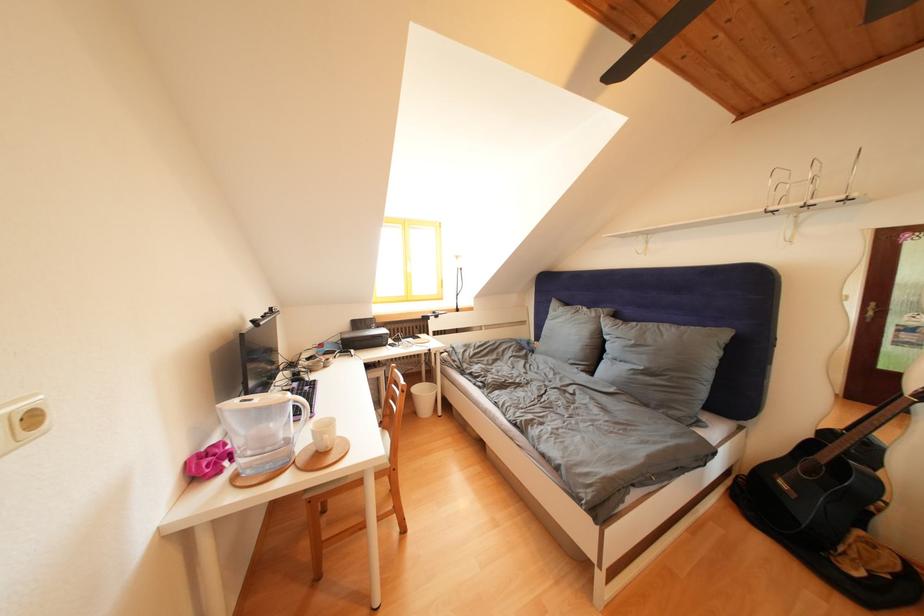
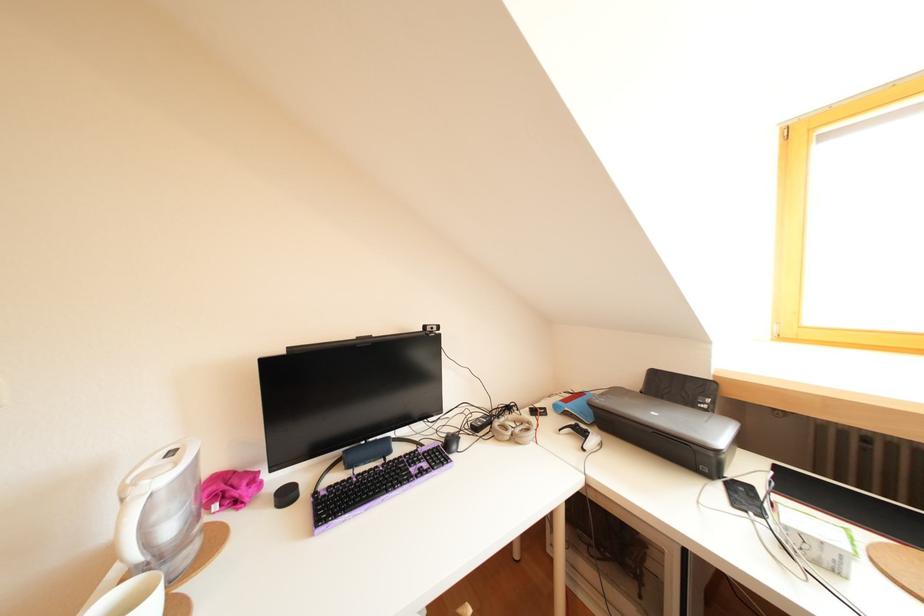
Locate, in the second image, the point that corresponds to (395,352) in the first image.

(727, 490)